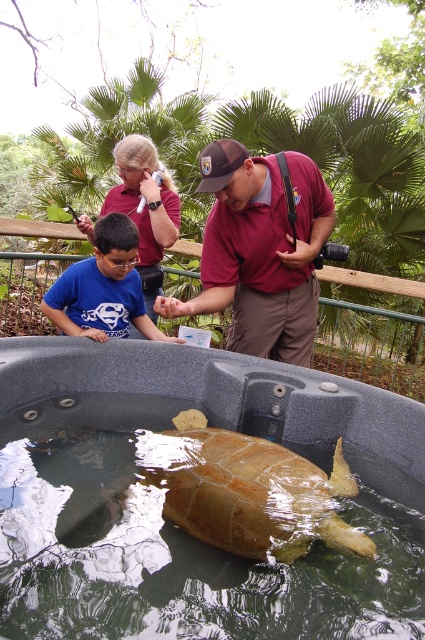
Question: Which object is positioned farthest from the brown textured shell at center?

Choices:
 (A) blue cotton shirt at center
 (B) translucent green water at center

Answer: (A)

Question: Can you confirm if maroon shirt at center is positioned to the left of brown textured shell at center?

Choices:
 (A) no
 (B) yes

Answer: (B)

Question: Which is farther from the blue cotton shirt at center?

Choices:
 (A) translucent green water at center
 (B) brown textured shell at center
 (C) maroon shirt at center

Answer: (B)

Question: From the image, what is the correct spatial relationship of maroon shirt at center in relation to brown textured shell at center?

Choices:
 (A) above
 (B) below

Answer: (A)

Question: Which point is farther from the camera taking this photo?

Choices:
 (A) (79, 288)
 (B) (78, 560)

Answer: (A)

Question: From the image, what is the correct spatial relationship of maroon shirt at center in relation to brown textured shell at center?

Choices:
 (A) right
 (B) left

Answer: (B)